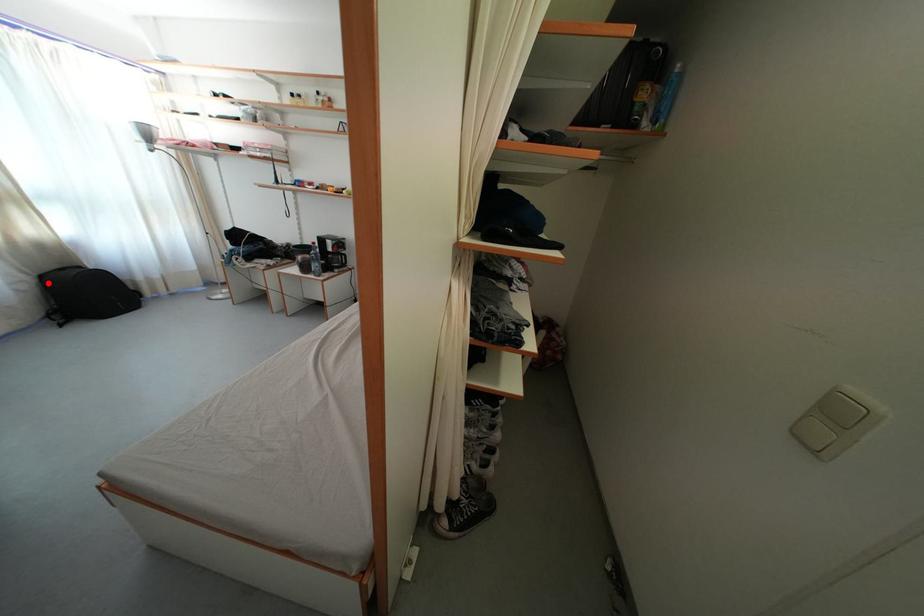
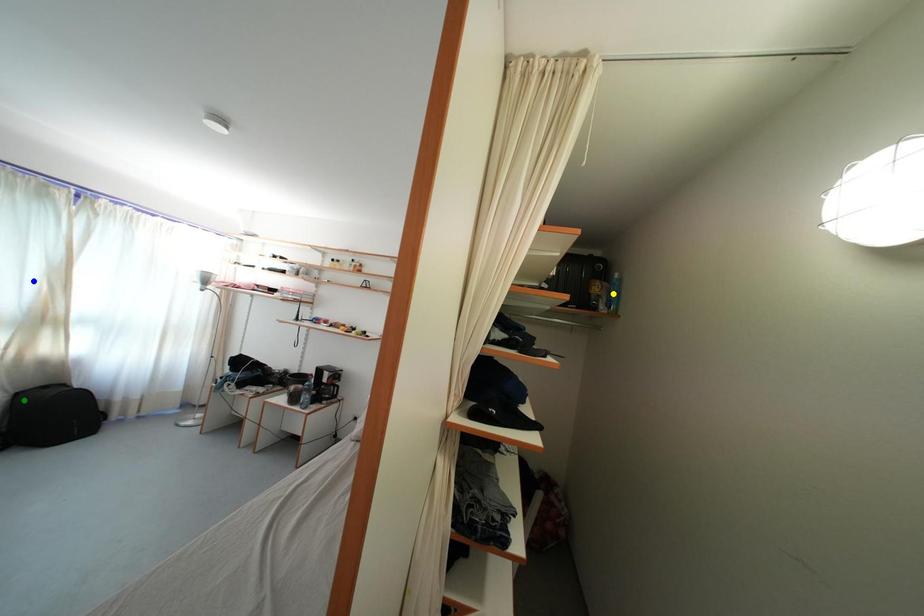
Question: I am providing you with two images of the same scene from different viewpoints. A red point is marked on the first image. You are given multiple points on the second image. Which mark in image 2 goes with the point in image 1?

Choices:
 (A) green point
 (B) blue point
 (C) yellow point

Answer: (A)